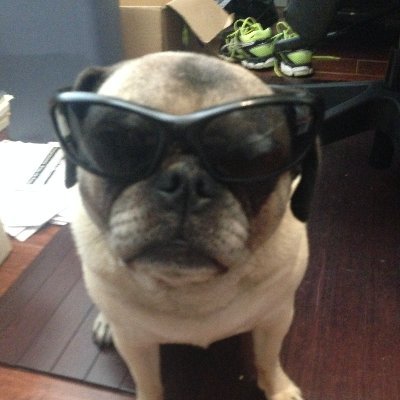
Identify the location of papers. (47, 155).